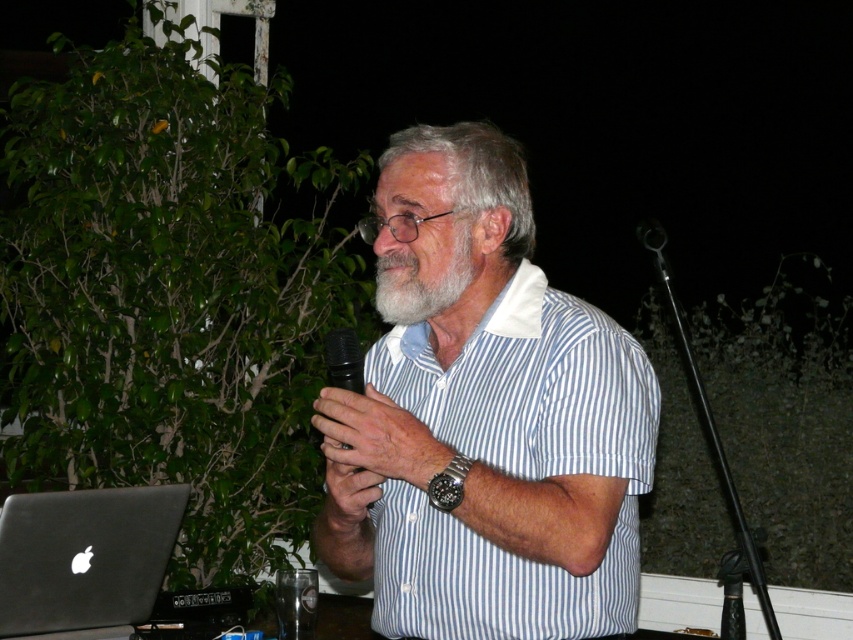
You are a photographer setting up for a night event. You see the matte black microphone at center and the grayhairbeard at center in the scene. Which object is shorter?

The matte black microphone at center is shorter than the grayhairbeard at center.

You are setting up a stage for a presentation and need to place the matte black microphone at center and the black plastic microphone at center on a podium. The podium has a height limit of 12 inches. Which microphone should you choose to ensure it doesn not exceed the height limit?

The matte black microphone at center is not as tall as the black plastic microphone at center, so the matte black microphone at center should be chosen to ensure it does not exceed the podium height limit.